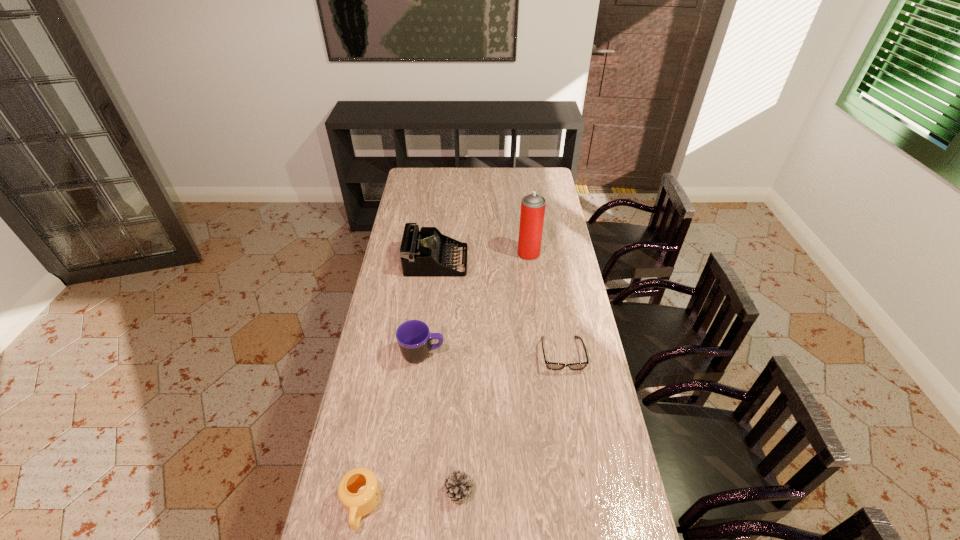
Where is `aerosol can`? aerosol can is located at coordinates (532, 212).

Locate an element on the screen. The width and height of the screenshot is (960, 540). typewriter is located at coordinates (423, 254).

The width and height of the screenshot is (960, 540). I want to click on the farther mug, so click(414, 338).

This screenshot has height=540, width=960. I want to click on the third tallest object, so click(414, 338).

Identify the location of the nearer mug. (359, 492).

Locate an element on the screen. the shorter mug is located at coordinates click(x=359, y=492).

Where is `the fifth tallest object`? The width and height of the screenshot is (960, 540). the fifth tallest object is located at coordinates click(458, 485).

Where is `the shortest object`? the shortest object is located at coordinates (550, 365).

Find the location of `vacant space located 0.340m on the front of the aerosol can`. vacant space located 0.340m on the front of the aerosol can is located at coordinates (537, 316).

The height and width of the screenshot is (540, 960). What are the coordinates of `vacant area situated 0.380m on the typing side of the typewriter` in the screenshot? It's located at (550, 261).